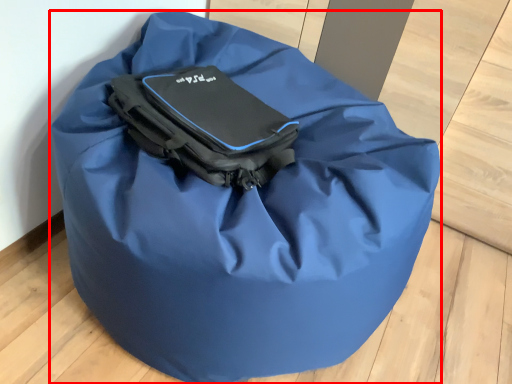
Question: In this image, where is luggage and bags (annotated by the red box) located relative to pack?

Choices:
 (A) right
 (B) left

Answer: (A)